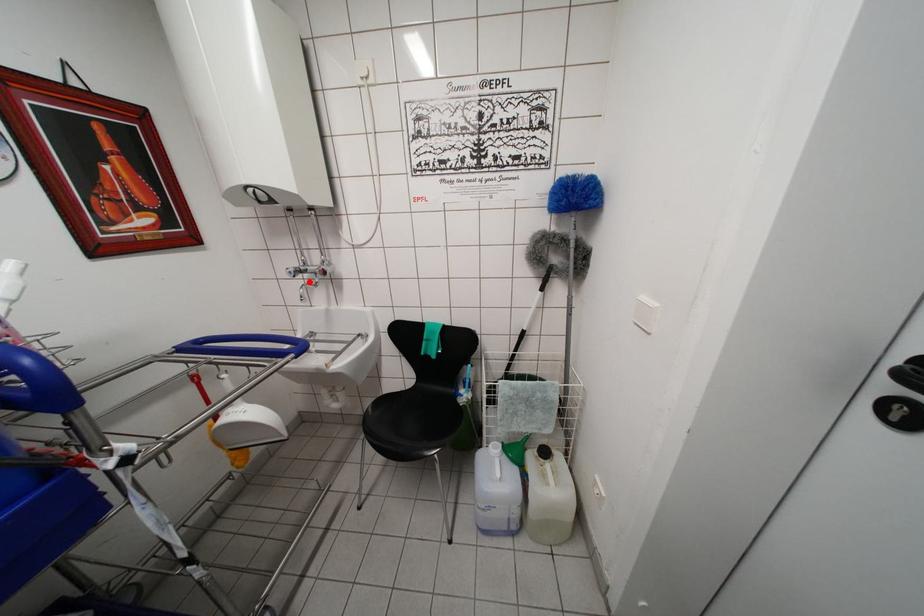
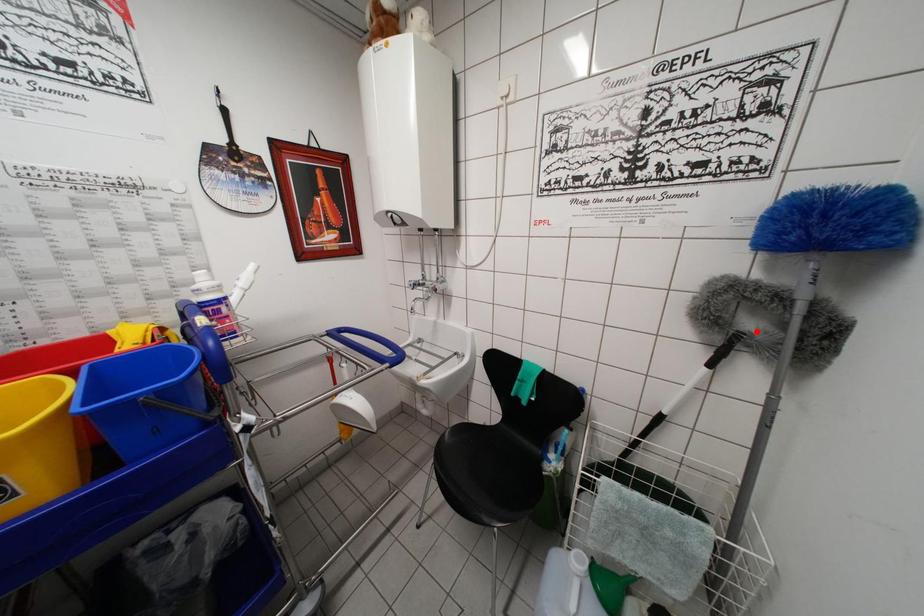
I am providing you with two images of the same scene from different viewpoints. A red point is marked on the first image and another point is marked on the second image. Do the highlighted points in image1 and image2 indicate the same real-world spot?

No